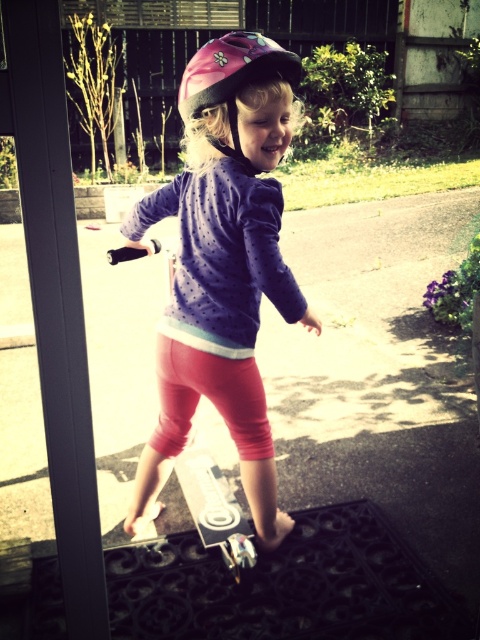
Question: Can you confirm if pink matte helmet at upper center is positioned to the left of pink glossy helmet at upper center?

Choices:
 (A) no
 (B) yes

Answer: (B)

Question: Does pink matte helmet at upper center have a greater width compared to pink glossy helmet at upper center?

Choices:
 (A) yes
 (B) no

Answer: (A)

Question: Does pink matte helmet at upper center have a smaller size compared to white glossy skateboard at center?

Choices:
 (A) no
 (B) yes

Answer: (A)

Question: Based on their relative distances, which object is farther from the white glossy skateboard at center?

Choices:
 (A) pink matte helmet at upper center
 (B) pink glossy helmet at upper center

Answer: (B)

Question: Based on their relative distances, which object is farther from the pink glossy helmet at upper center?

Choices:
 (A) pink matte helmet at upper center
 (B) white glossy skateboard at center

Answer: (B)

Question: Which object appears farthest from the camera in this image?

Choices:
 (A) pink matte helmet at upper center
 (B) white glossy skateboard at center
 (C) pink glossy helmet at upper center

Answer: (B)